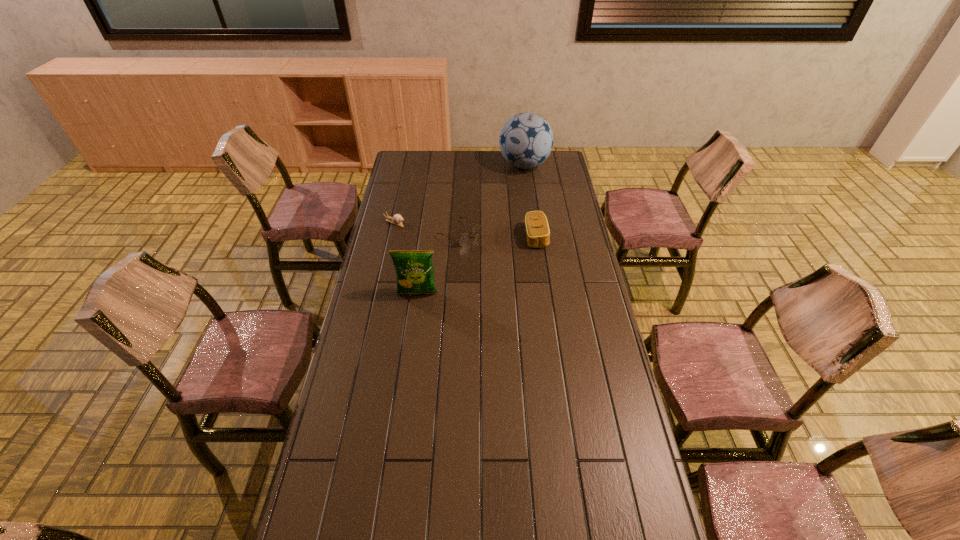
At what (x,y) coordinates should I click in order to perform the action: click on crisp (potato chip) that is at the left edge. Please return your answer as a coordinate pair (x, y). This screenshot has height=540, width=960. Looking at the image, I should click on (415, 275).

Identify the location of escargot located in the left edge section of the desktop. (397, 219).

Where is `clutch bag located at the right edge`? Image resolution: width=960 pixels, height=540 pixels. clutch bag located at the right edge is located at coordinates (537, 230).

Identify the location of soccer ball that is at the right edge. This screenshot has height=540, width=960. (526, 140).

You are a GUI agent. You are given a task and a screenshot of the screen. Output one action in this format:
    pyautogui.click(x=<x>, y=<y>)
    Task: Click on the object at the far right corner
    Image resolution: width=960 pixels, height=540 pixels.
    Given the screenshot: What is the action you would take?
    pyautogui.click(x=526, y=140)

Find the location of a particular element. The height and width of the screenshot is (540, 960). vacant space at the far edge of the desktop is located at coordinates (446, 162).

Where is `vacant area at the left edge of the desktop`? vacant area at the left edge of the desktop is located at coordinates (338, 456).

Identify the location of vacant area at the right edge. (556, 180).

The width and height of the screenshot is (960, 540). In order to click on free region at the far left corner of the desktop in this screenshot , I will do point(415,170).

I want to click on free spot between the clutch bag and the tallest object, so (x=530, y=201).